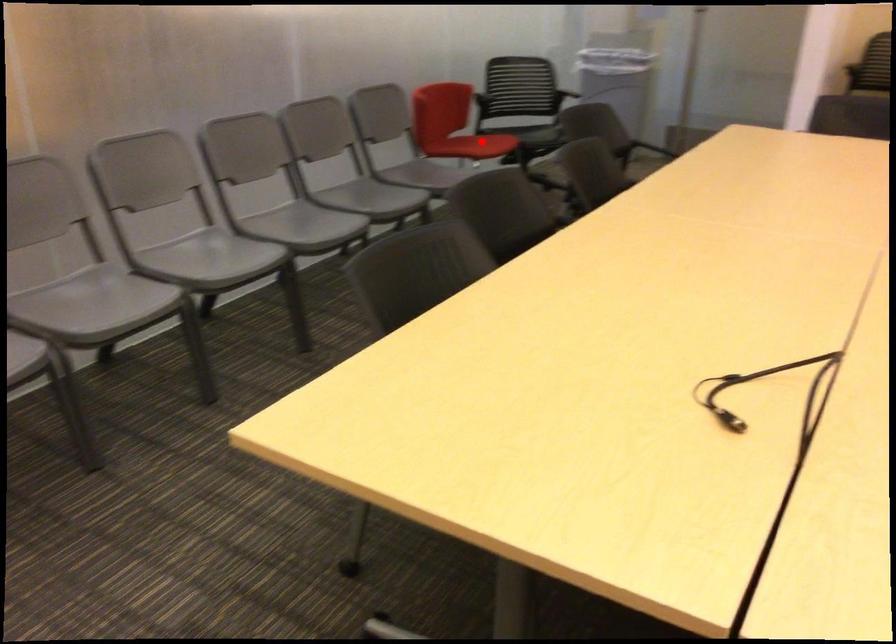
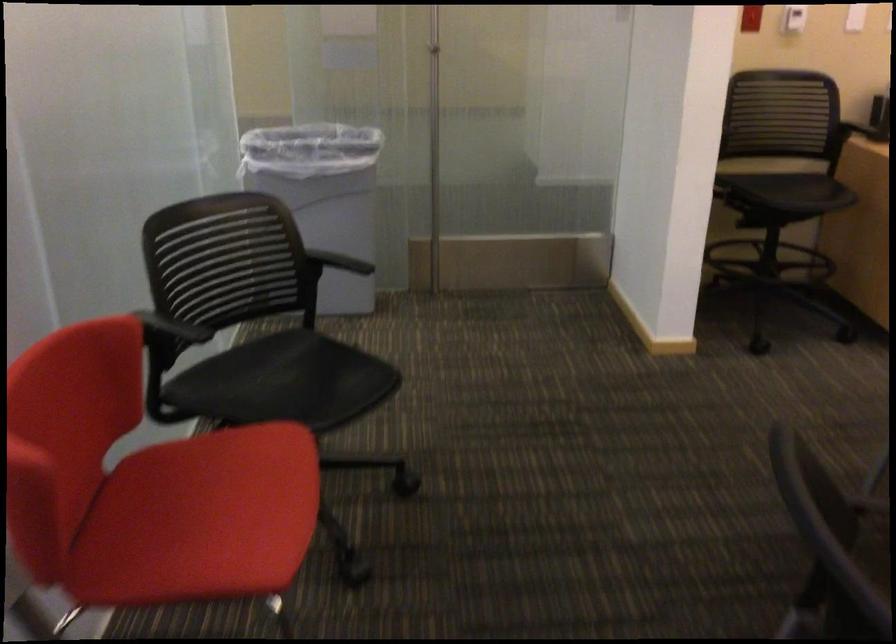
Question: I am providing you with two images of the same scene from different viewpoints. Image1 has a red point marked. In image2, the corresponding 3D location appears at what relative position? Reply with the corresponding letter.

Choices:
 (A) Closer
 (B) Farther

Answer: (A)